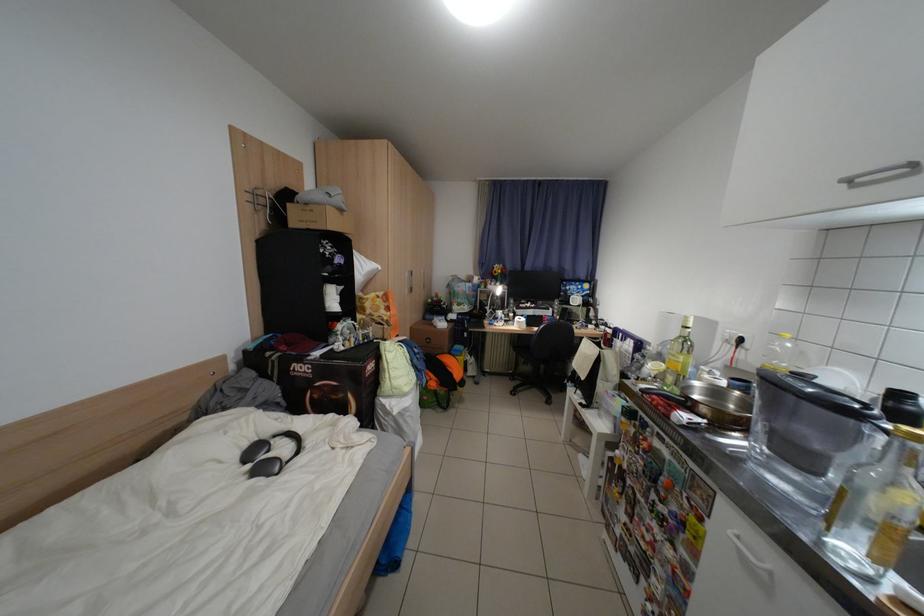
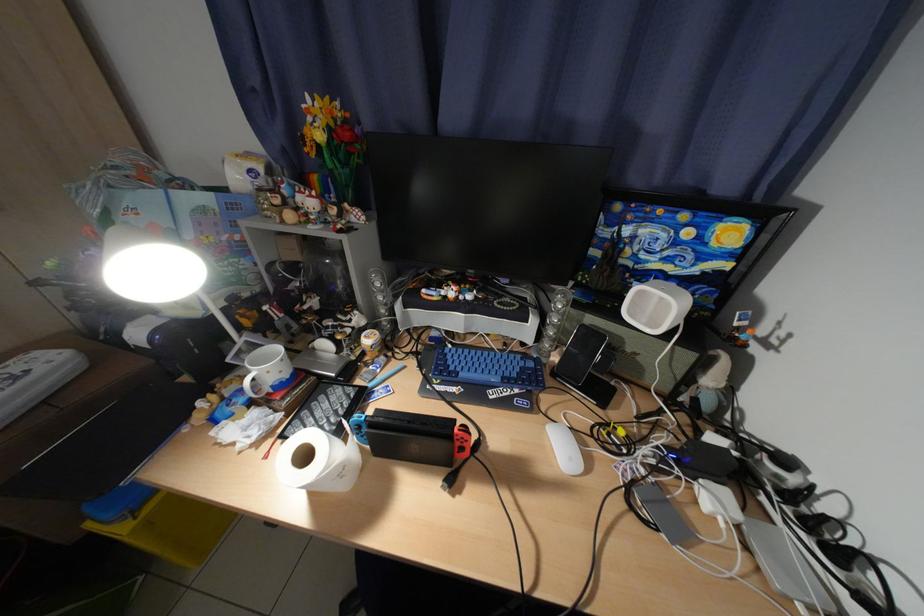
Locate, in the second image, the point that corresponds to [523,315] in the first image.

(381, 341)